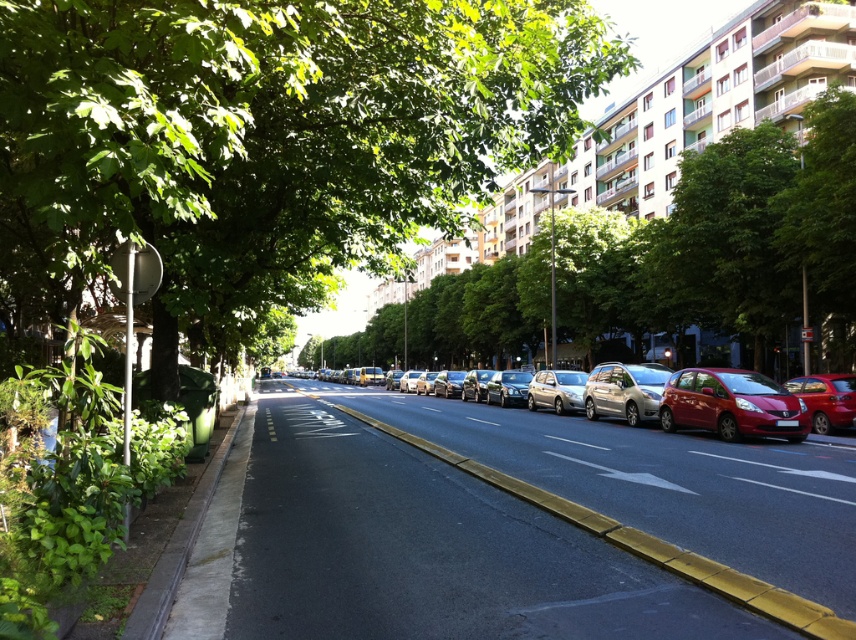
You are standing on the sidewalk and want to walk to the green leafy tree at center. According to the image, in which direction should you walk relative to your current position?

The green leafy tree at center is located at point (266, 141), so you should walk towards the center of the image to reach it.

You are standing on the sidewalk looking down the street. There is a point marked at coordinates (266, 141). What object is located at that point?

The point at coordinates (266, 141) indicates a green leafy tree at center.